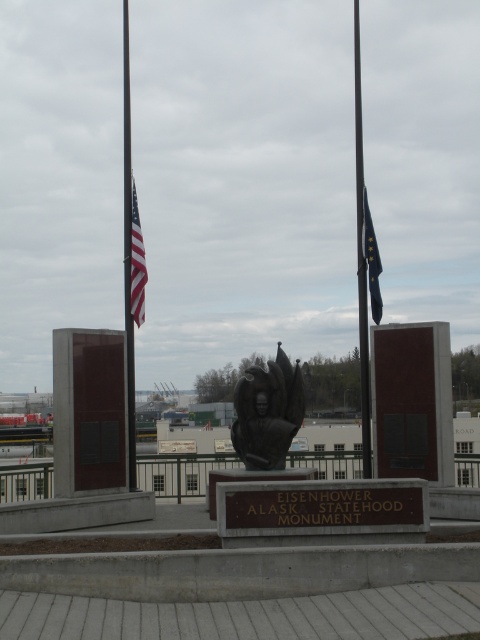
Question: Where is matte black flag at center located in relation to dark blue fabric flag at right in the image?

Choices:
 (A) below
 (B) above

Answer: (B)

Question: Can you confirm if bronze statue at center is positioned to the right of matte black flag at center?

Choices:
 (A) no
 (B) yes

Answer: (B)

Question: Based on their relative distances, which object is farther from the bronze statue at center?

Choices:
 (A) metallic flagpole at center
 (B) dark blue fabric flag at right

Answer: (A)

Question: Which object is farther from the camera taking this photo?

Choices:
 (A) bronze statue at center
 (B) matte black flag at center

Answer: (B)

Question: Estimate the real-world distances between objects in this image. Which object is farther from the bronze statue at center?

Choices:
 (A) dark blue fabric flag at right
 (B) matte black flag at center
 (C) metallic flagpole at center
 (D) polished metal flagpole at left

Answer: (C)

Question: Does bronze statue at center appear on the right side of matte black flag at center?

Choices:
 (A) yes
 (B) no

Answer: (A)